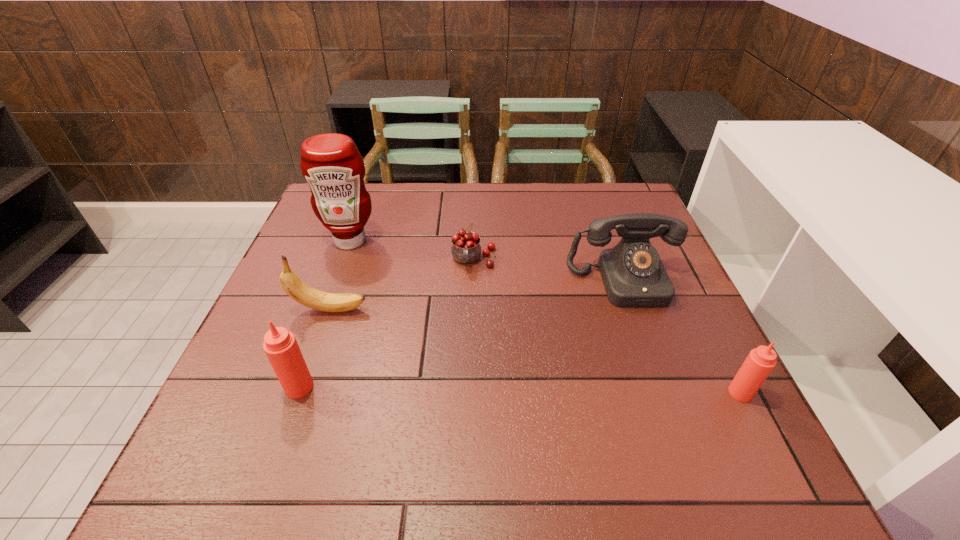
Image resolution: width=960 pixels, height=540 pixels. Find the location of `the taller Tabasco sauce`. the taller Tabasco sauce is located at coordinates (280, 345).

Where is `the right Tabasco sauce`? The image size is (960, 540). the right Tabasco sauce is located at coordinates [760, 362].

Locate an element on the screen. the shortest object is located at coordinates (466, 249).

The image size is (960, 540). In order to click on the fourth object from left to right in this screenshot , I will do [466, 249].

Locate an element on the screen. The image size is (960, 540). banana is located at coordinates (299, 291).

Find the location of a particular element. This screenshot has height=540, width=960. telephone is located at coordinates (633, 275).

Where is `the tallest object`? the tallest object is located at coordinates (331, 163).

The height and width of the screenshot is (540, 960). Find the location of `free space located 0.050m on the left of the left Tabasco sauce`. free space located 0.050m on the left of the left Tabasco sauce is located at coordinates (260, 387).

At what (x,y) coordinates should I click in order to perform the action: click on free spot located 0.360m on the back of the right Tabasco sauce. Please return your answer as a coordinate pair (x, y). Image resolution: width=960 pixels, height=540 pixels. Looking at the image, I should click on (676, 265).

In order to click on vacant region located on the handle side of the shortest object in this screenshot , I will do `click(472, 350)`.